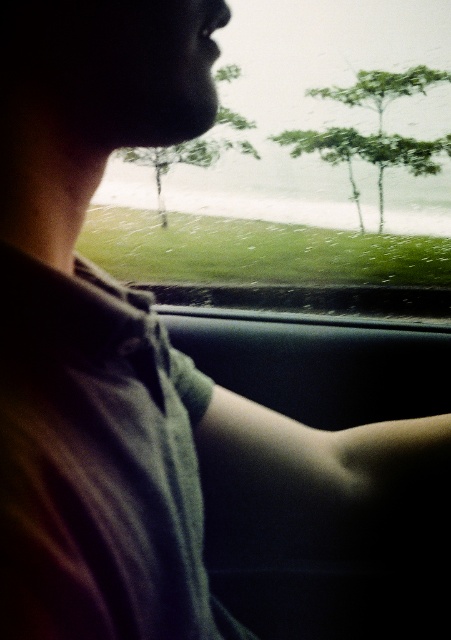
Does transparent glass windshield at upper center have a smaller size compared to green matte tree at center?

Correct, transparent glass windshield at upper center occupies less space than green matte tree at center.

The width and height of the screenshot is (451, 640). Describe the element at coordinates (300, 102) in the screenshot. I see `transparent glass windshield at upper center` at that location.

Locate an element on the screen. transparent glass windshield at upper center is located at coordinates (300, 102).

What do you see at coordinates (300, 102) in the screenshot? This screenshot has height=640, width=451. I see `transparent glass windshield at upper center` at bounding box center [300, 102].

Which is behind, point (274, 45) or point (426, 152)?

Positioned behind is point (274, 45).

Is point (400, 45) farther from camera compared to point (446, 81)?

Yes.

At what (x,y) coordinates should I click in order to perform the action: click on transparent glass windshield at upper center. Please return your answer as a coordinate pair (x, y). This screenshot has width=451, height=640. Looking at the image, I should click on (300, 102).

Measure the distance between green leafy tree at upper center and green matte tree at center.

The distance of green leafy tree at upper center from green matte tree at center is 2.35 meters.

What do you see at coordinates (372, 132) in the screenshot? I see `green leafy tree at upper center` at bounding box center [372, 132].

Find the location of a particular element. green leafy tree at upper center is located at coordinates (372, 132).